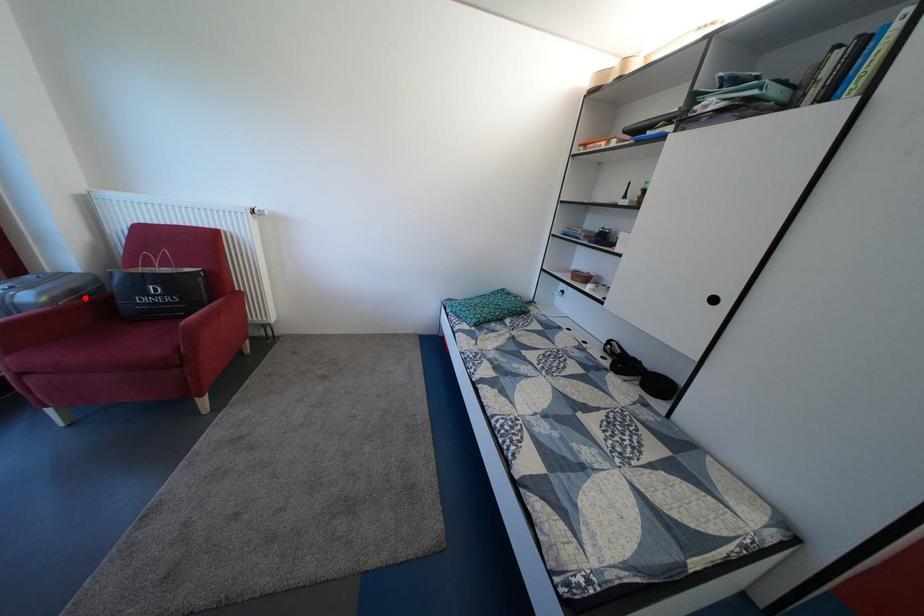
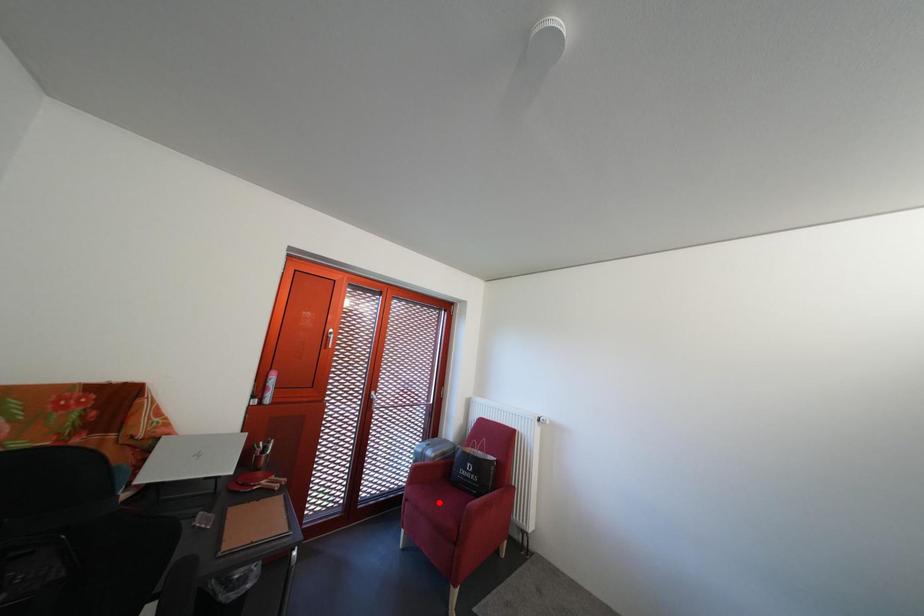
I am providing you with two images of the same scene from different viewpoints. A red point is marked on the first image and another point is marked on the second image. Does the point marked in image1 correspond to the same location as the one in image2?

No